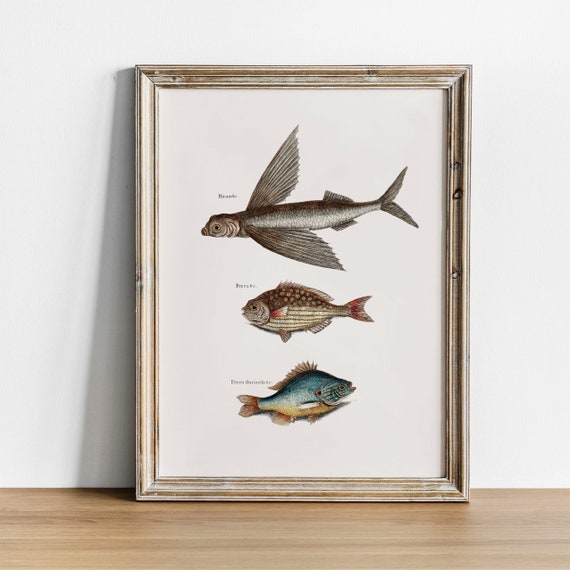
Identify the location of gray wall. (547, 139), (52, 378).